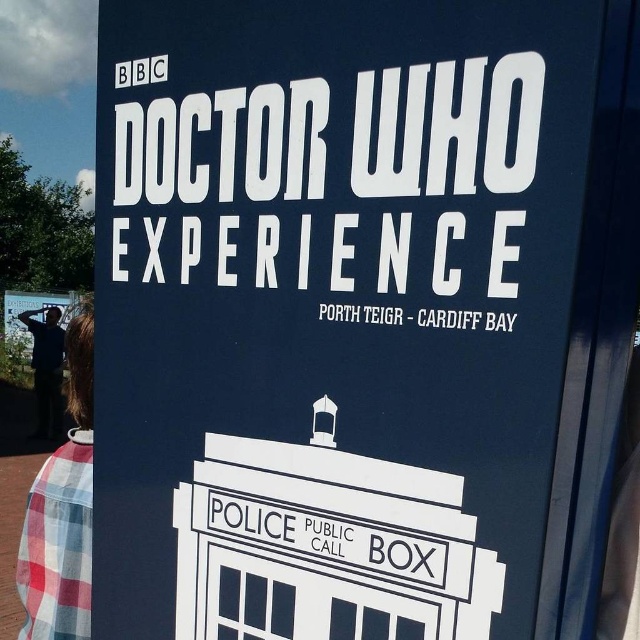
Question: Among these objects, which one is nearest to the camera?

Choices:
 (A) dark blue shirt at left
 (B) plaid shirt at lower left

Answer: (B)

Question: Which point is closer to the camera?

Choices:
 (A) (36, 429)
 (B) (17, 563)

Answer: (B)

Question: Is plaid shirt at lower left to the right of dark blue shirt at left from the viewer's perspective?

Choices:
 (A) no
 (B) yes

Answer: (B)

Question: Is plaid shirt at lower left to the right of dark blue shirt at left from the viewer's perspective?

Choices:
 (A) yes
 (B) no

Answer: (A)

Question: Does plaid shirt at lower left have a lesser width compared to dark blue shirt at left?

Choices:
 (A) yes
 (B) no

Answer: (A)